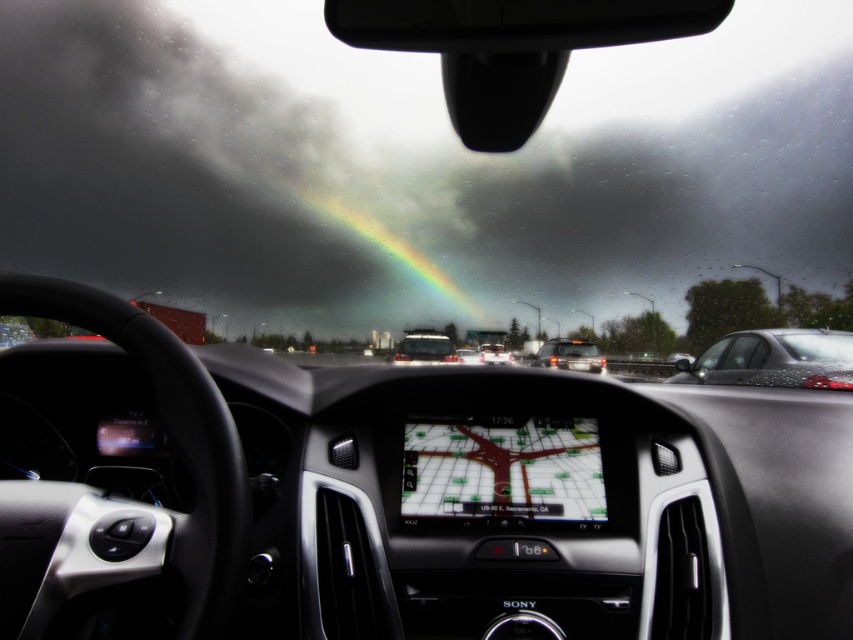
Who is positioned more to the left, shiny black sedan at right or matte black sedan at center?

matte black sedan at center is more to the left.

Who is positioned more to the right, shiny black sedan at right or matte black sedan at center?

shiny black sedan at right is more to the right.

Measure the distance between shiny black sedan at right and camera.

They are 16.15 feet apart.

Find the location of a particular element. The width and height of the screenshot is (853, 640). shiny black sedan at right is located at coordinates (775, 358).

From the picture: Is matte black bus at center above matte black sedan at center?

Indeed, matte black bus at center is positioned over matte black sedan at center.

Between matte black bus at center and matte black sedan at center, which one has more height?

With more height is matte black sedan at center.

Who is more distant from viewer, (x=433, y=349) or (x=456, y=353)?

Point (x=456, y=353)

You are a GUI agent. You are given a task and a screenshot of the screen. Output one action in this format:
    pyautogui.click(x=<x>, y=<y>)
    Task: Click on the matte black bus at center
    This screenshot has width=853, height=640.
    Given the screenshot: What is the action you would take?
    pyautogui.click(x=424, y=348)

Can you confirm if rainbow at center is positioned to the right of matte black bus at center?

In fact, rainbow at center is to the left of matte black bus at center.

Find the location of a particular element. rainbow at center is located at coordinates (387, 246).

Where is `rainbow at center`? The width and height of the screenshot is (853, 640). rainbow at center is located at coordinates (387, 246).